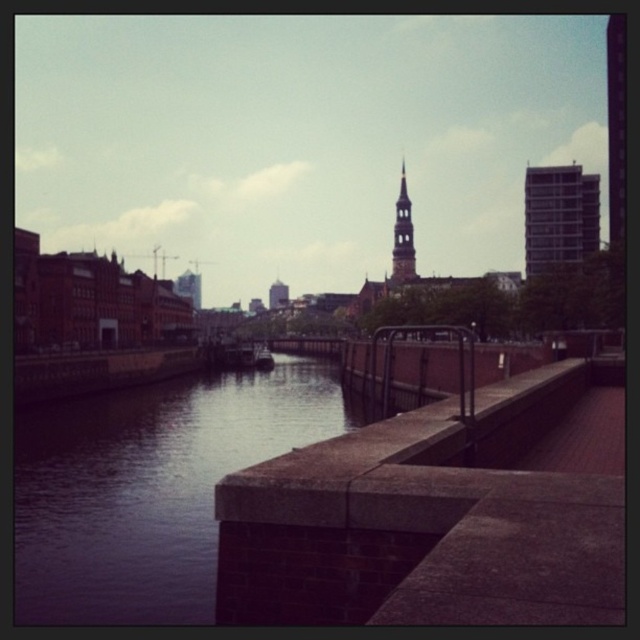
You are standing on the paved walkway and want to take a photo of both the dark gray concrete river at center and the gray concrete building at upper right. Which object should you focus on first to ensure both are in clear view?

You should focus on the dark gray concrete river at center first because it is closer to you than the gray concrete building at upper right, ensuring both are in focus when using a camera with depth of field considerations.

You are standing on the paved walkway with a 160 feet long rope. You want to tie it to the dark gray concrete river at center. Is the rope long enough to reach the river?

The dark gray concrete river at center is 158.92 feet away from you, so yes, the 160 feet long rope is long enough to reach it.